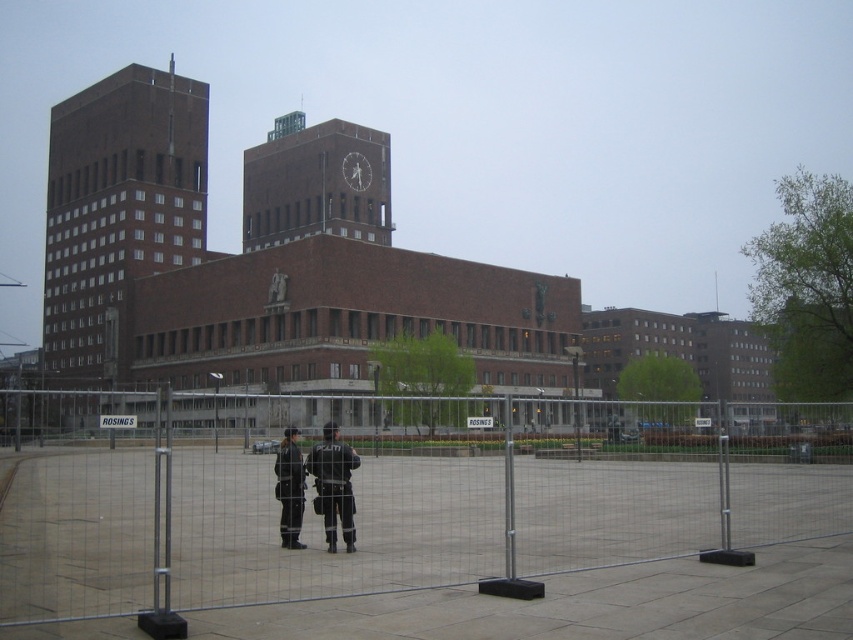
Looking at this image, you are a visitor at the city hall and see the silver wire mesh fence at center and the black leather jacket at center. From your perspective, which object is positioned to the left?

The black leather jacket at center is positioned to the left of the silver wire mesh fence at center.

You are a visitor standing in front of the large building. You notice the brown brick tower at left and the brick clock tower at center. Which of these two structures is closer to you?

The brown brick tower at left is closer to you because it is in front of the brick clock tower at center.